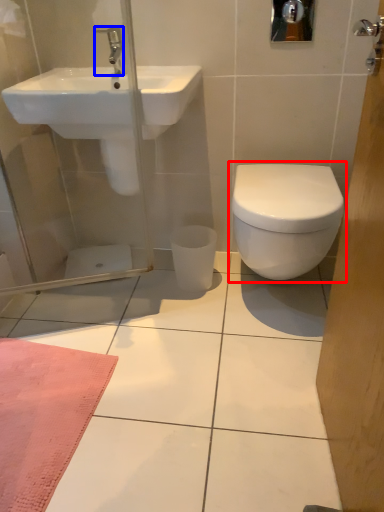
Question: Which object appears farthest to the camera in this image, toilet (highlighted by a red box) or tap (highlighted by a blue box)?

Choices:
 (A) toilet
 (B) tap

Answer: (B)